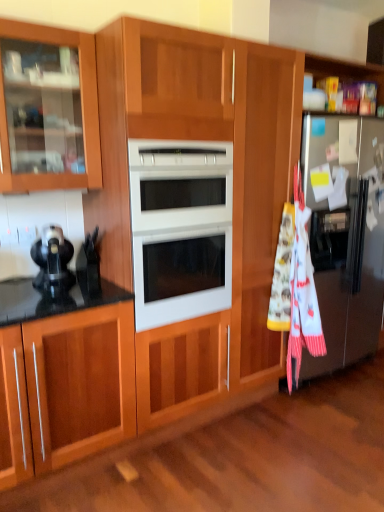
Question: Can you see white cotton beach towel at right touching silver metallic refrigerator at right?

Choices:
 (A) no
 (B) yes

Answer: (A)

Question: Is white cotton beach towel at right oriented away from silver metallic refrigerator at right?

Choices:
 (A) yes
 (B) no

Answer: (B)

Question: Considering the relative sizes of white cotton beach towel at right and silver metallic refrigerator at right in the image provided, is white cotton beach towel at right smaller than silver metallic refrigerator at right?

Choices:
 (A) yes
 (B) no

Answer: (A)

Question: Does white cotton beach towel at right have a lesser width compared to silver metallic refrigerator at right?

Choices:
 (A) no
 (B) yes

Answer: (B)

Question: Is white cotton beach towel at right further to camera compared to silver metallic refrigerator at right?

Choices:
 (A) yes
 (B) no

Answer: (B)

Question: Could you tell me if white cotton beach towel at right is facing silver metallic refrigerator at right?

Choices:
 (A) yes
 (B) no

Answer: (B)

Question: Is matte black coffee maker at left positioned behind silver metallic refrigerator at right?

Choices:
 (A) yes
 (B) no

Answer: (B)

Question: Can you confirm if matte black coffee maker at left is positioned to the right of silver metallic refrigerator at right?

Choices:
 (A) yes
 (B) no

Answer: (B)

Question: Does matte black coffee maker at left have a greater width compared to silver metallic refrigerator at right?

Choices:
 (A) yes
 (B) no

Answer: (B)

Question: Would you consider matte black coffee maker at left to be distant from silver metallic refrigerator at right?

Choices:
 (A) no
 (B) yes

Answer: (B)

Question: Considering the relative sizes of matte black coffee maker at left and silver metallic refrigerator at right in the image provided, is matte black coffee maker at left thinner than silver metallic refrigerator at right?

Choices:
 (A) no
 (B) yes

Answer: (B)

Question: Could you tell me if matte black coffee maker at left is turned towards silver metallic refrigerator at right?

Choices:
 (A) no
 (B) yes

Answer: (A)

Question: Is silver metallic refrigerator at right further to camera compared to matte black coffee maker at left?

Choices:
 (A) yes
 (B) no

Answer: (A)